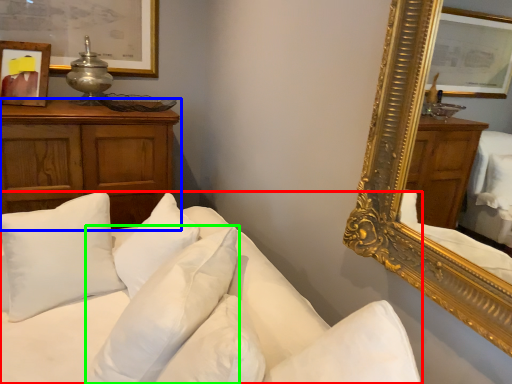
Question: Estimate the real-world distances between objects in this image. Which object is farther from studio couch (highlighted by a red box), cabinetry (highlighted by a blue box) or pillow (highlighted by a green box)?

Choices:
 (A) cabinetry
 (B) pillow

Answer: (A)